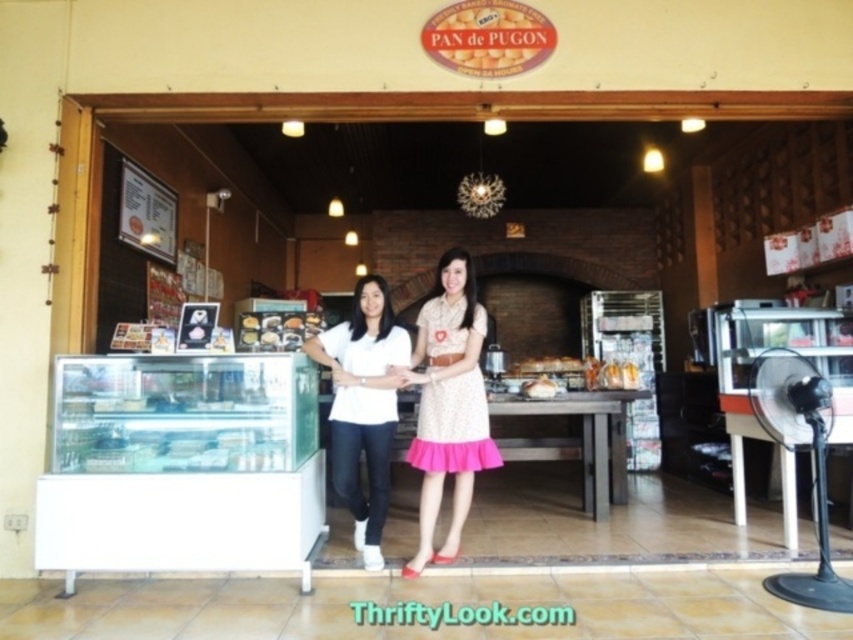
Is pink satin dress at center closer to camera compared to golden brown bread at center?

Yes, it is in front of golden brown bread at center.

What do you see at coordinates (448, 403) in the screenshot?
I see `pink satin dress at center` at bounding box center [448, 403].

Is point (474, 433) less distant than point (552, 381)?

That is True.

Find the location of a particular element. pink satin dress at center is located at coordinates (448, 403).

Can you confirm if matte brown bread at center is shorter than golden brown bread at center?

Incorrect, matte brown bread at center's height does not fall short of golden brown bread at center's.

Is point (425, 26) less distant than point (540, 385)?

Yes.

The image size is (853, 640). What are the coordinates of `matte brown bread at center` in the screenshot? It's located at (488, 36).

From the picture: Is white matte shirt at center smaller than golden brown bread at center?

Actually, white matte shirt at center might be larger than golden brown bread at center.

Does white matte shirt at center appear over golden brown bread at center?

No, white matte shirt at center is not above golden brown bread at center.

Between point (340, 403) and point (538, 385), which one is positioned in front?

Point (340, 403) is more forward.

Image resolution: width=853 pixels, height=640 pixels. I want to click on white matte shirt at center, so click(x=363, y=404).